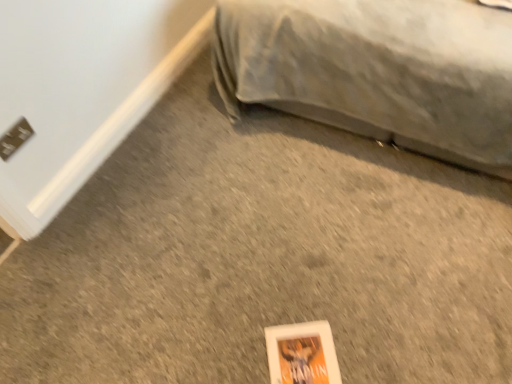
At what (x,y) coordinates should I click in order to perform the action: click on free space that is to the left of white matte paperback book at lower center. Please return your answer as a coordinate pair (x, y). Looking at the image, I should click on (226, 349).